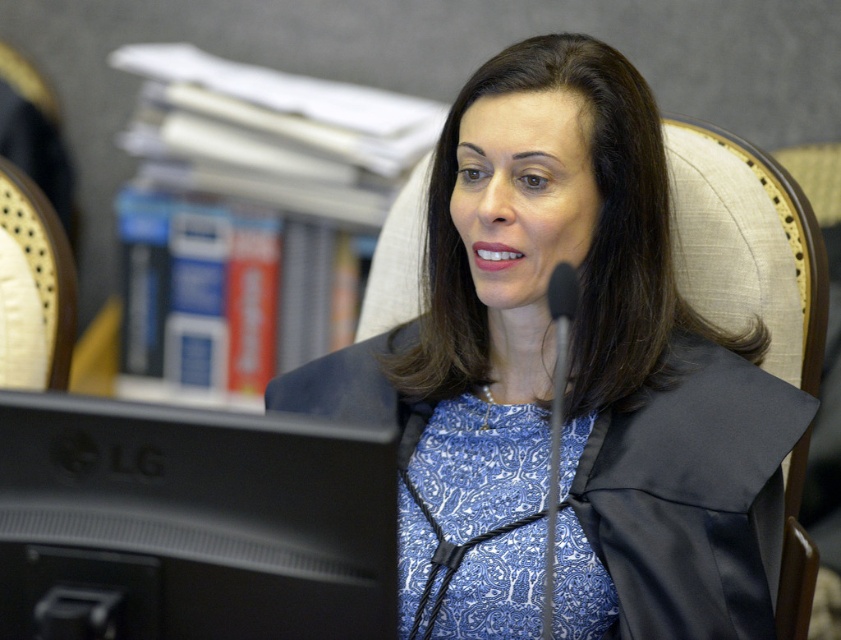
You are a photographer trying to capture a closeup of the blue printed dress at center and the black matte monitor at lower left. Based on their positions, which object should you focus on first to ensure both are in frame?

The blue printed dress at center is located above the black matte monitor at lower left, so you should focus on the black matte monitor at lower left first to ensure both are in frame.

You are designing a layout for a presentation and need to place a blue printed dress at center and a black matte monitor at lower left. Given their sizes, which object should be placed first to ensure proper spacing?

The blue printed dress at center should be placed first since its width is greater than the black matte monitor at lower left, ensuring there is enough space allocated for it in the layout.

Based on the photo, you are a photographer setting up for a portrait. The subject is wearing a blue printed dress at center. You want to ensure the dress is in focus while keeping the background slightly blurred. Based on the scene description, what is the minimum distance you should set your camera focus to capture the dress clearly?

The blue printed dress at center is 3.94 feet from the camera, so you should set the focus distance to at least 3.94 feet to ensure the dress is in focus while maintaining a blurred background.